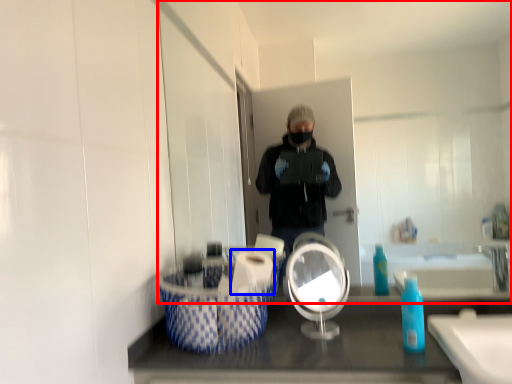
Question: Which object is closer to the camera taking this photo, mirror (highlighted by a red box) or toilet paper (highlighted by a blue box)?

Choices:
 (A) mirror
 (B) toilet paper

Answer: (B)